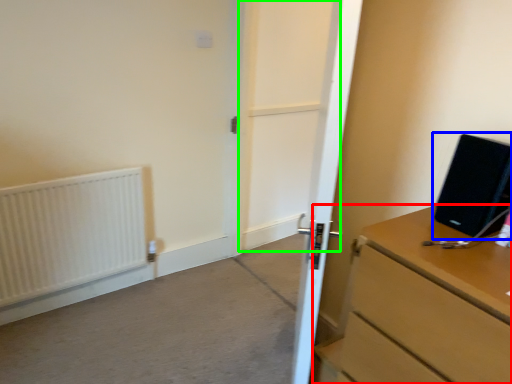
Question: Based on their relative distances, which object is nearer to chest of drawers (highlighted by a red box)? Choose from desktop computer (highlighted by a blue box) and screen door (highlighted by a green box).

Choices:
 (A) desktop computer
 (B) screen door

Answer: (A)